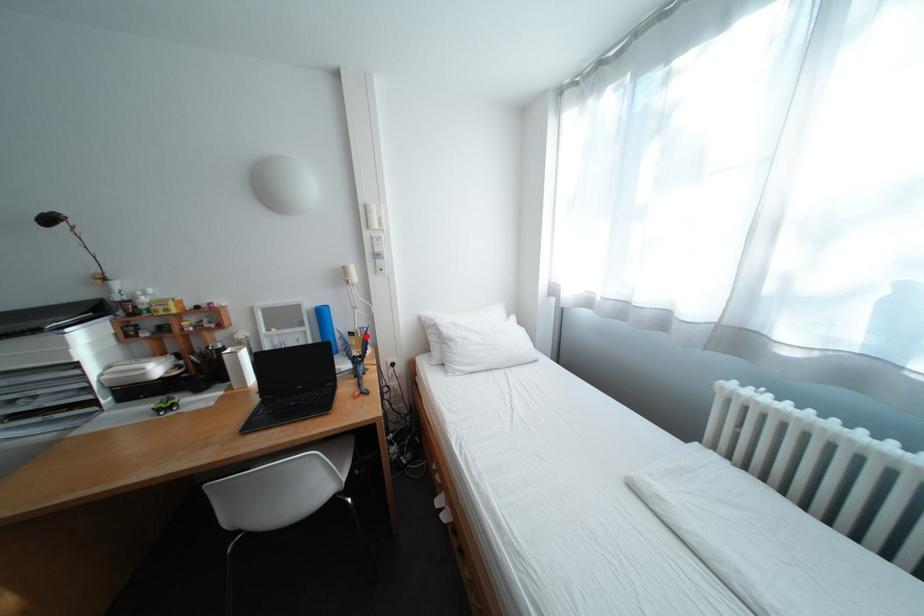
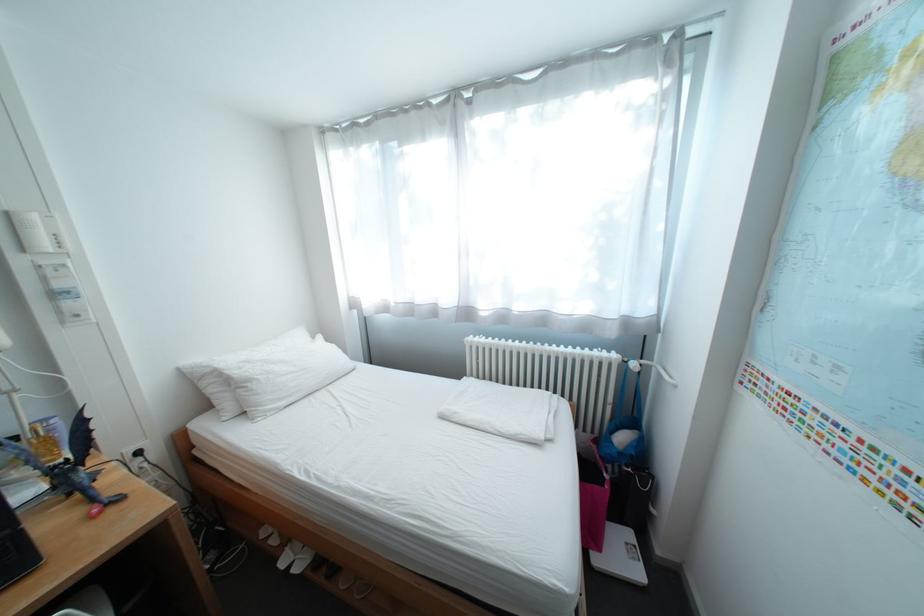
Question: I am providing you with two images of the same scene from different viewpoints. A red point is marked on the first image. Is the red point's position out of view in image 2?

Choices:
 (A) Yes
 (B) No

Answer: (B)